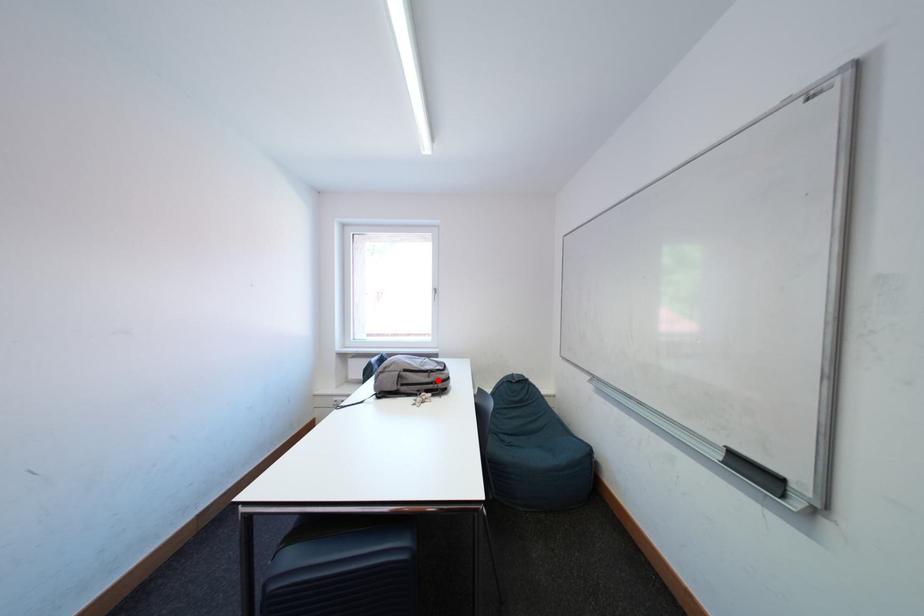
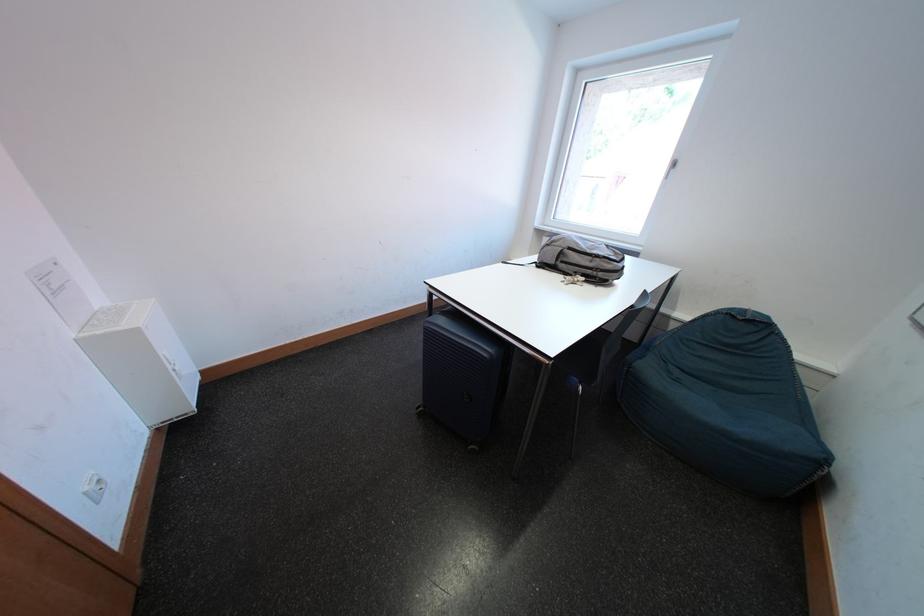
Locate, in the second image, the point that corresponds to the highlighted location in the first image.

(601, 265)